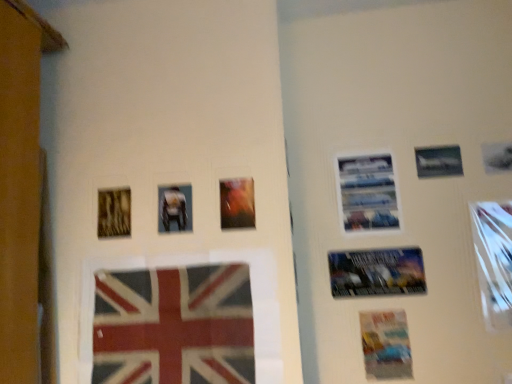
Question: Looking at their shapes, would you say metallic silver poster at center right, the 2th poster when ordered from bottom to top, is wider or thinner than textured fabric flag at lower center?

Choices:
 (A) wide
 (B) thin

Answer: (B)

Question: Considering the positions of point (402, 248) and point (207, 382), is point (402, 248) closer or farther from the camera than point (207, 382)?

Choices:
 (A) farther
 (B) closer

Answer: (A)

Question: Considering the real-world distances, which object is farthest from the metallic silver airplane at upper right, positioned as the 5th picture frame in left-to-right order?

Choices:
 (A) matte paper poster at lower right, marked as the third poster in a top-to-bottom arrangement
 (B) metallic silver poster at center right, which appears as the 2th poster when viewed from the top
 (C) matte plastic picture frame at center, the third picture frame viewed from the left
 (D) matte plastic photo frame at center, which is the second picture frame in left-to-right order
 (E) metallic silver airplane at upper right, marked as the 3th picture frame in a right-to-left arrangement

Answer: (D)

Question: Which of these objects is positioned closest to the metallic silver poster at center right, which appears as the 2th poster when viewed from the top?

Choices:
 (A) textured fabric flag at lower center
 (B) metallic silver picture frame at right, which appears as the sixth picture frame when viewed from the left
 (C) metallic silver airplane at upper right, acting as the 2th picture frame starting from the right
 (D) matte plastic picture frame at center, which is the fourth picture frame in right-to-left order
 (E) metallic silver poster at upper right, marked as the third poster in a bottom-to-top arrangement

Answer: (E)